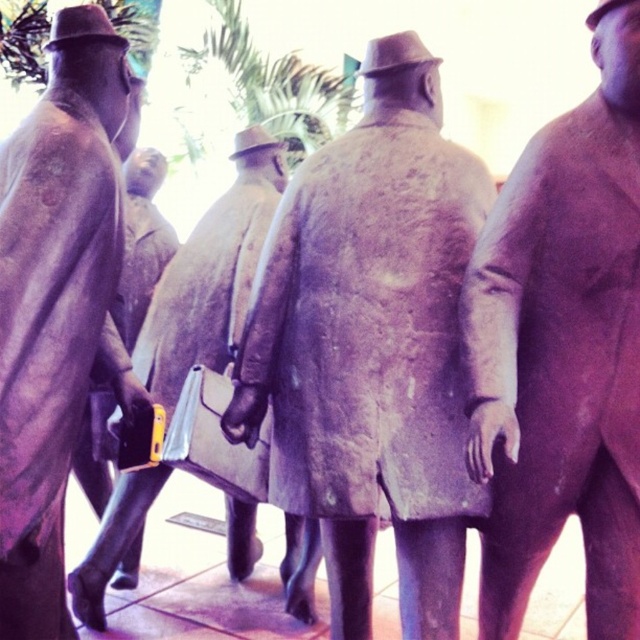
You are an art curator planning to display the matte gray coat at center and the matte bronze statue at center in a new exhibition. Given their sizes, which object should be placed on a higher pedestal to ensure both are visible to visitors standing at eye level?

The matte gray coat at center is much taller than the matte bronze statue at center, so it should be placed on a lower pedestal to ensure both are visible at eye level.

You are a tour guide leading a group of visitors. You want to ensure that visitors can comfortably walk between the matte brown coat at center and the matte bronze statue at center. The path between them is 86.95 centimeters wide. If a visitor is carrying a 50 cm wide umbrella, will they be able to pass through the path without difficulty?

The path between the matte brown coat at center and the matte bronze statue at center is 86.95 centimeters wide. Since the umbrella is 50 cm wide, there will be sufficient space for the visitor to pass through comfortably.